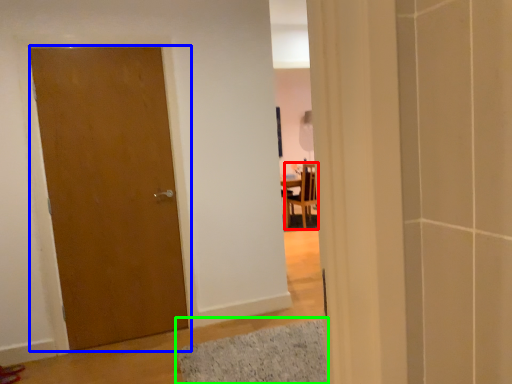
Question: Which object is the farthest from chair (highlighted by a red box)? Choose among these: door (highlighted by a blue box) or bath mat (highlighted by a green box).

Choices:
 (A) door
 (B) bath mat

Answer: (A)